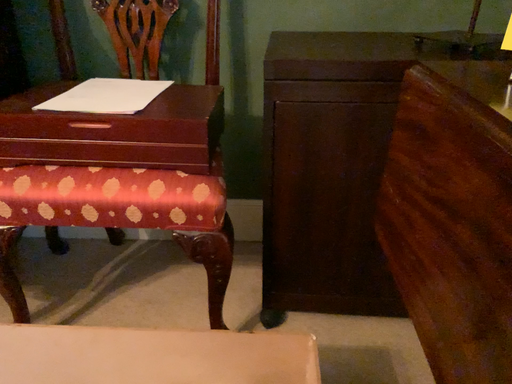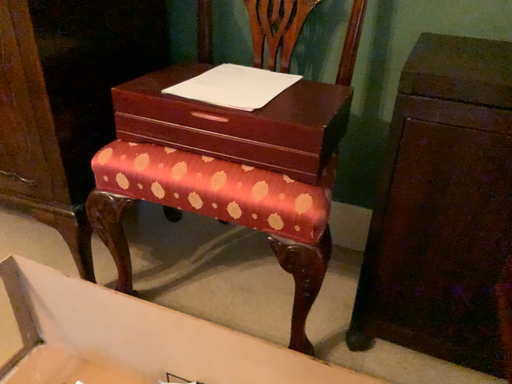
Question: Which way did the camera rotate in the video?

Choices:
 (A) rotated left
 (B) rotated right

Answer: (A)